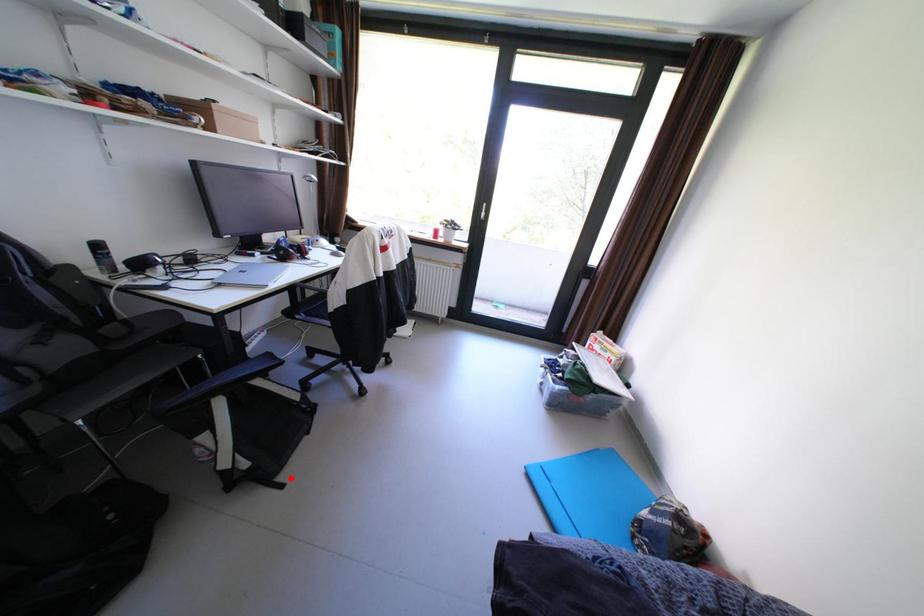
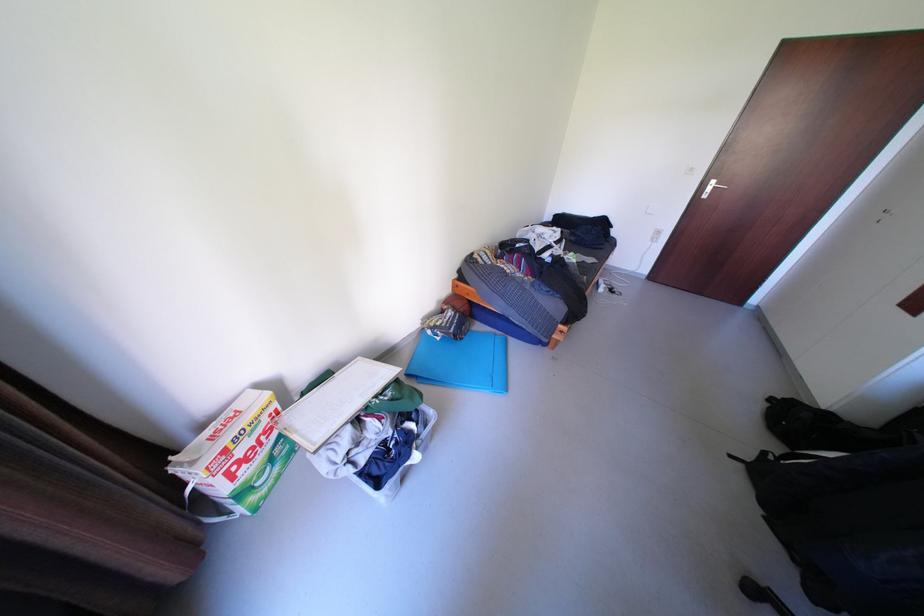
Find the pixel in the second image that matches the highlighted location in the first image.

(752, 466)